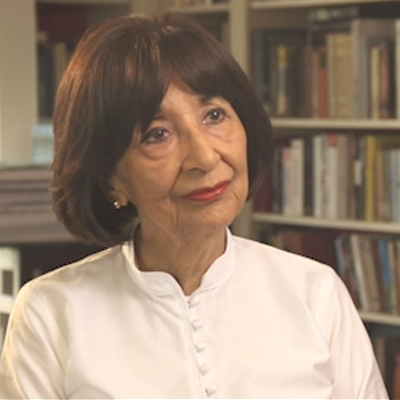
Locate an element on the screen. bookshelves in background is located at coordinates (345, 101), (347, 192), (363, 274), (383, 353).